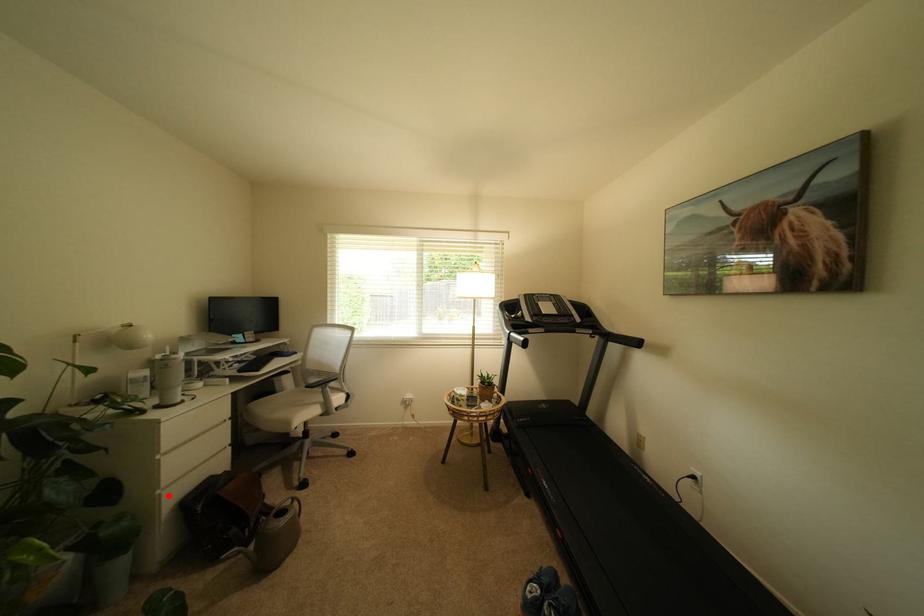
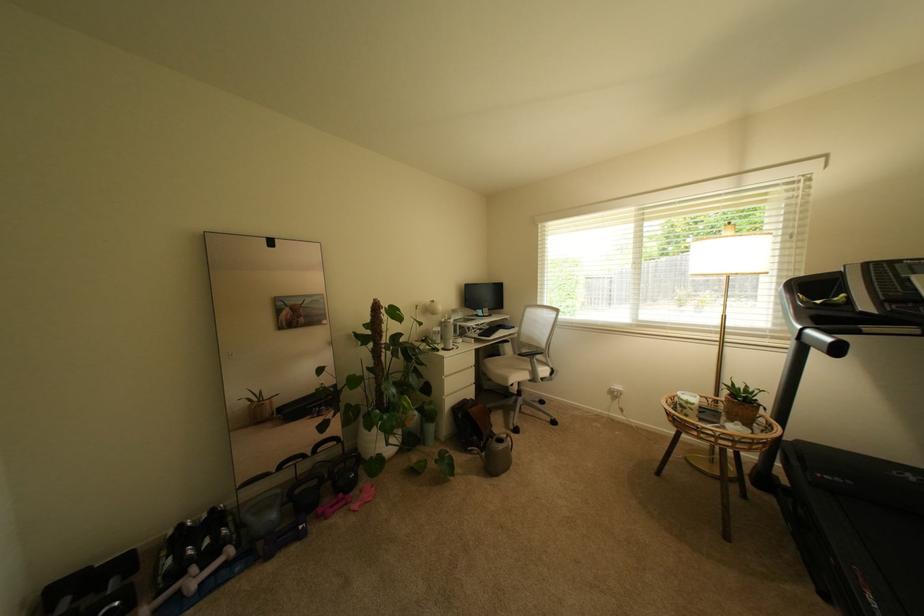
In the second image, find the point that corresponds to the highlighted location in the first image.

(453, 400)